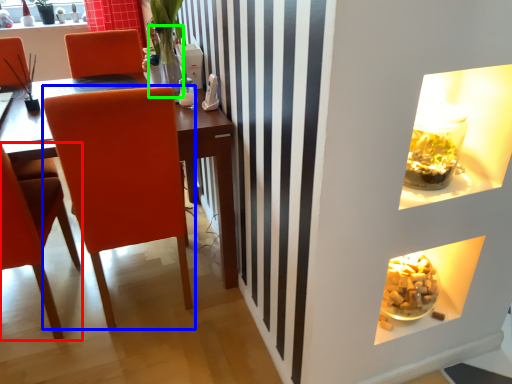
Question: Which object is the closest to the chair (highlighted by a red box)? Choose among these: chair (highlighted by a blue box) or glass vase (highlighted by a green box).

Choices:
 (A) chair
 (B) glass vase

Answer: (A)